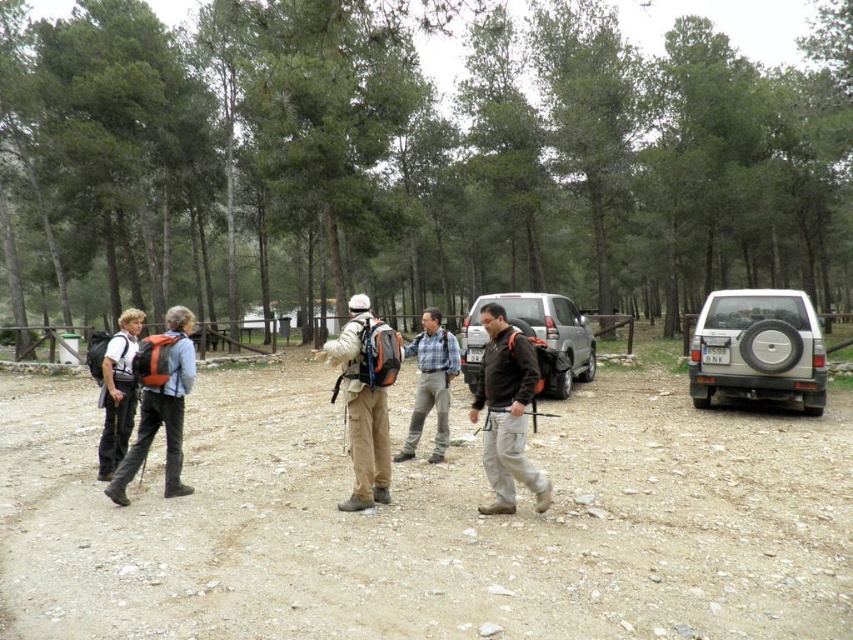
Is dark brown leather jacket at center to the left of plaid fabric shirt at center from the viewer's perspective?

Incorrect, dark brown leather jacket at center is not on the left side of plaid fabric shirt at center.

Based on the photo, who is more forward, (497,364) or (434,346)?

Positioned in front is point (497,364).

You are a GUI agent. You are given a task and a screenshot of the screen. Output one action in this format:
    pyautogui.click(x=<x>, y=<y>)
    Task: Click on the dark brown leather jacket at center
    This screenshot has width=853, height=640.
    Given the screenshot: What is the action you would take?
    click(506, 412)

Who is shorter, green leafy tree at center or dark brown leather jacket at center?

Standing shorter between the two is dark brown leather jacket at center.

Which is in front, point (572, 45) or point (514, 440)?

Point (514, 440)

The image size is (853, 640). What are the coordinates of `green leafy tree at center` in the screenshot? It's located at (410, 161).

Consider the image. Is green leafy tree at center to the left of silver metallic jeep at center from the viewer's perspective?

In fact, green leafy tree at center is to the right of silver metallic jeep at center.

Between green leafy tree at center and silver metallic jeep at center, which one has less height?

With less height is silver metallic jeep at center.

You are a GUI agent. You are given a task and a screenshot of the screen. Output one action in this format:
    pyautogui.click(x=<x>, y=<y>)
    Task: Click on the green leafy tree at center
    The height and width of the screenshot is (640, 853).
    Given the screenshot: What is the action you would take?
    pyautogui.click(x=410, y=161)